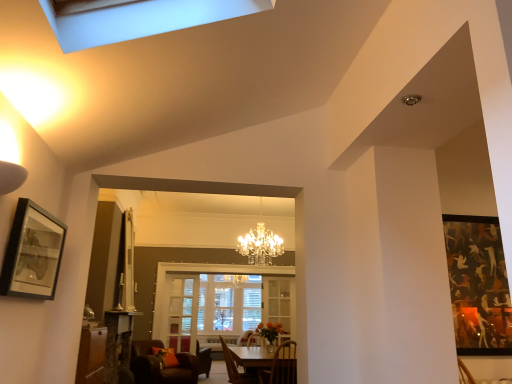
Question: Does point (251, 354) appear closer or farther from the camera than point (229, 362)?

Choices:
 (A) closer
 (B) farther

Answer: (B)

Question: In the image, is wooden table at center positioned in front of or behind wooden chair at lower center, which is the 2th chair from back to front?

Choices:
 (A) front
 (B) behind

Answer: (A)

Question: Which object is the farthest from the wooden table at center?

Choices:
 (A) clear glass door at center
 (B) wooden chair at lower center, which appears as the first chair when viewed from the front
 (C) wooden chair at lower center, the 2th chair viewed from the front
 (D) matte black picture frame at left
 (E) brown leather chair at lower left, the 3th chair positioned from the front

Answer: (D)

Question: Which object is positioned closest to the wooden table at center?

Choices:
 (A) wooden chair at lower center, placed as the 3th chair when sorted from left to right
 (B) matte black picture frame at left
 (C) clear glass door at center
 (D) wooden chair at lower center, the 2th chair in the right-to-left sequence
 (E) brown leather chair at lower left, which is the first chair in left-to-right order

Answer: (A)